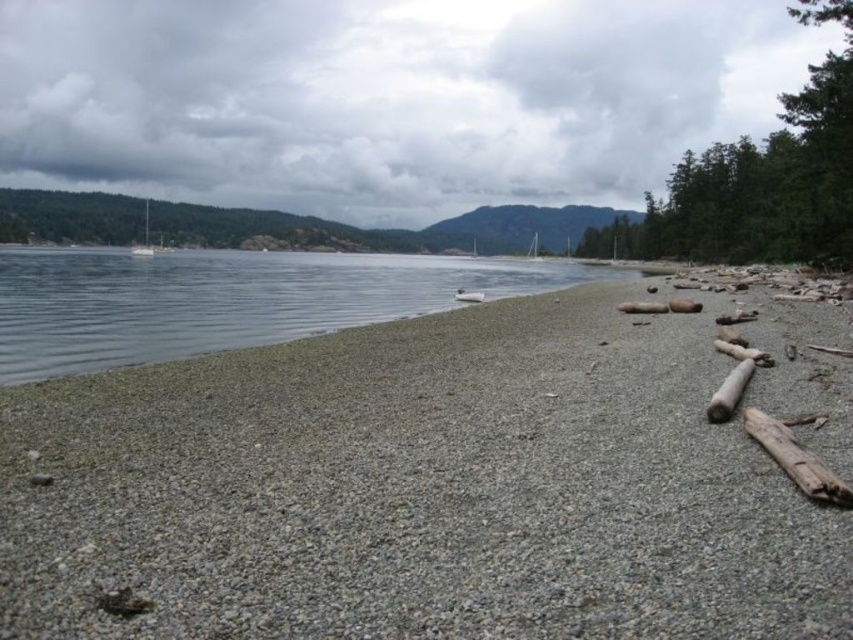
You are a photographer planning to capture the reflection of the sky in the image. Which area between the gray gravelly sand at lower left and the clear water at center would provide a better surface for reflecting the sky?

The clear water at center provides a better surface for reflecting the sky because it is wider than the gray gravelly sand at lower left, allowing for a more expansive and smoother reflective surface.

You are standing at the center of the beach in the coastal scene. You see a point labeled as point (x=416, y=490). What is located at that point?

The point (x=416, y=490) indicates gray gravelly sand at lower left.